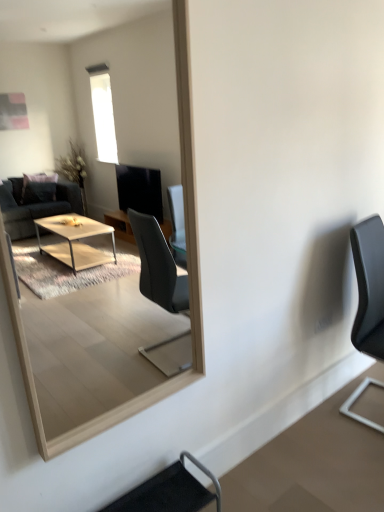
Question: From the image's perspective, is black matte chair at right, acting as the first chair starting from the back, above or below wooden frame mirror at center?

Choices:
 (A) below
 (B) above

Answer: (A)

Question: Based on their sizes in the image, would you say black matte chair at right, which is the first chair from right to left, is bigger or smaller than wooden frame mirror at center?

Choices:
 (A) big
 (B) small

Answer: (A)

Question: Estimate the real-world distances between objects in this image. Which object is closer to the wooden frame mirror at center?

Choices:
 (A) black leather chair at lower center, placed as the second chair when sorted from top to bottom
 (B) black matte chair at right, the 2th chair positioned from the bottom

Answer: (A)

Question: Which is nearer to the black leather chair at lower center, placed as the second chair when sorted from top to bottom?

Choices:
 (A) black matte chair at right, positioned as the 1th chair in top-to-bottom order
 (B) wooden frame mirror at center

Answer: (A)